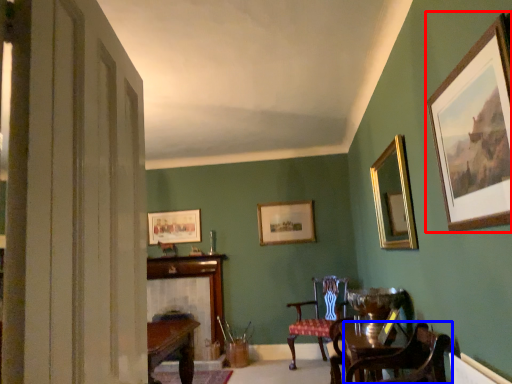
Question: Among these objects, which one is farthest to the camera, picture frame (highlighted by a red box) or chair (highlighted by a blue box)?

Choices:
 (A) picture frame
 (B) chair

Answer: (B)